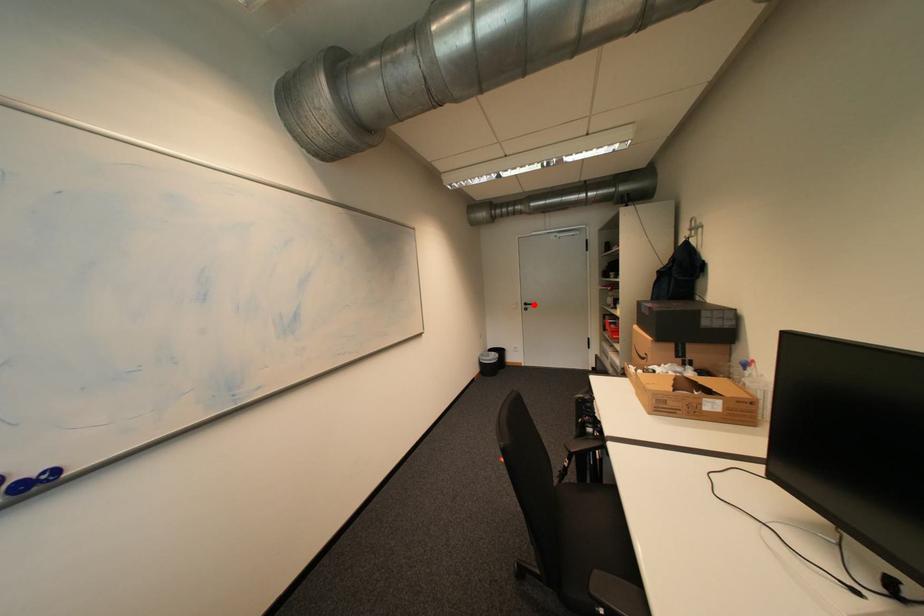
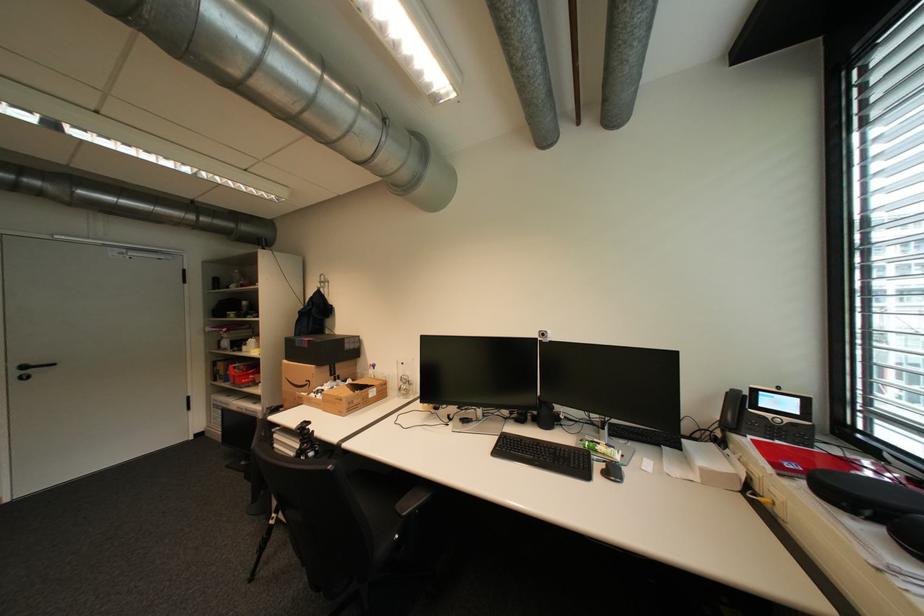
Find the pixel in the second image that matches the highlighted location in the first image.

(32, 368)